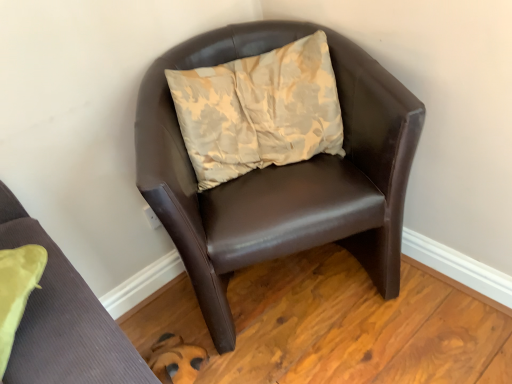
Question: Does brown leather chair at center, the first chair in the back-to-front sequence, appear on the right side of beige floral cushion at center?

Choices:
 (A) no
 (B) yes

Answer: (B)

Question: Does brown leather chair at center, the first chair in the back-to-front sequence, have a lesser width compared to beige floral cushion at center?

Choices:
 (A) yes
 (B) no

Answer: (B)

Question: From a real-world perspective, is brown leather chair at center, the first chair in the back-to-front sequence, on top of beige floral cushion at center?

Choices:
 (A) no
 (B) yes

Answer: (A)

Question: Does brown leather chair at center, the first chair in the back-to-front sequence, turn towards beige floral cushion at center?

Choices:
 (A) yes
 (B) no

Answer: (A)

Question: Is brown leather chair at center, the first chair in the back-to-front sequence, smaller than beige floral cushion at center?

Choices:
 (A) no
 (B) yes

Answer: (A)

Question: Does brown leather chair at center, the first chair in the back-to-front sequence, appear on the left side of beige floral cushion at center?

Choices:
 (A) no
 (B) yes

Answer: (A)

Question: From the image's perspective, does brown leather chair at upper right, acting as the first chair starting from the front, appear lower than beige floral cushion at center?

Choices:
 (A) yes
 (B) no

Answer: (A)

Question: Considering the relative sizes of brown leather chair at upper right, which is the 2th chair from back to front, and beige floral cushion at center in the image provided, is brown leather chair at upper right, which is the 2th chair from back to front, smaller than beige floral cushion at center?

Choices:
 (A) no
 (B) yes

Answer: (A)

Question: Is brown leather chair at upper right, acting as the first chair starting from the front, not within beige floral cushion at center?

Choices:
 (A) yes
 (B) no

Answer: (A)

Question: Is brown leather chair at upper right, acting as the first chair starting from the front, in front of beige floral cushion at center?

Choices:
 (A) no
 (B) yes

Answer: (B)

Question: Are brown leather chair at upper right, acting as the first chair starting from the front, and beige floral cushion at center located far from each other?

Choices:
 (A) no
 (B) yes

Answer: (A)

Question: Is brown leather chair at upper right, which is the 2th chair from back to front, at the left side of beige floral cushion at center?

Choices:
 (A) yes
 (B) no

Answer: (A)

Question: Does brown leather chair at upper right, acting as the first chair starting from the front, have a greater height compared to brown leather chair at center, acting as the second chair starting from the front?

Choices:
 (A) no
 (B) yes

Answer: (A)